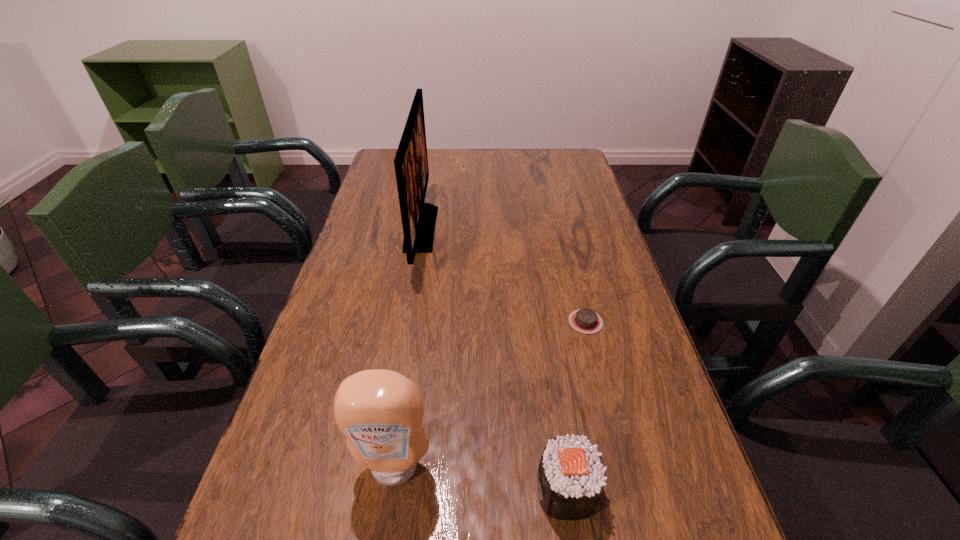
Where is `monitor`? Image resolution: width=960 pixels, height=540 pixels. monitor is located at coordinates (418, 218).

In order to click on the tallest object in this screenshot , I will do `click(418, 218)`.

In order to click on the second tallest object in this screenshot , I will do click(x=380, y=412).

In order to click on the second object from right to left in this screenshot , I will do `click(570, 479)`.

Find the location of `the third tallest object`. the third tallest object is located at coordinates (570, 479).

Locate an element on the screen. This screenshot has height=540, width=960. the third nearest object is located at coordinates (583, 320).

This screenshot has height=540, width=960. Identify the location of the rightmost object. (583, 320).

Where is `vacant space located 0.060m on the front-facing side of the monitor`? vacant space located 0.060m on the front-facing side of the monitor is located at coordinates (455, 228).

Find the location of a particular element. This screenshot has width=960, height=540. vacant area situated 0.050m on the label of the condiment is located at coordinates (386, 521).

You are a GUI agent. You are given a task and a screenshot of the screen. Output one action in this format:
    pyautogui.click(x=<x>, y=<y>)
    Task: Click on the free space located on the back of the third tallest object
    The width and height of the screenshot is (960, 540).
    Given the screenshot: What is the action you would take?
    pyautogui.click(x=548, y=360)